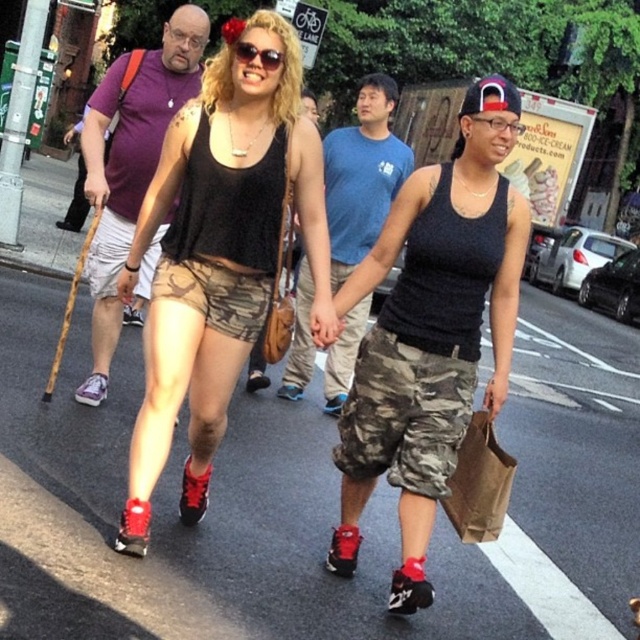
You are standing at the center of the crosswalk in the urban street scene. You see a point marked at coordinates [131,166]. What object or person is located at that point?

The point at coordinates [131,166] corresponds to the purple cotton t shirt at upper left.